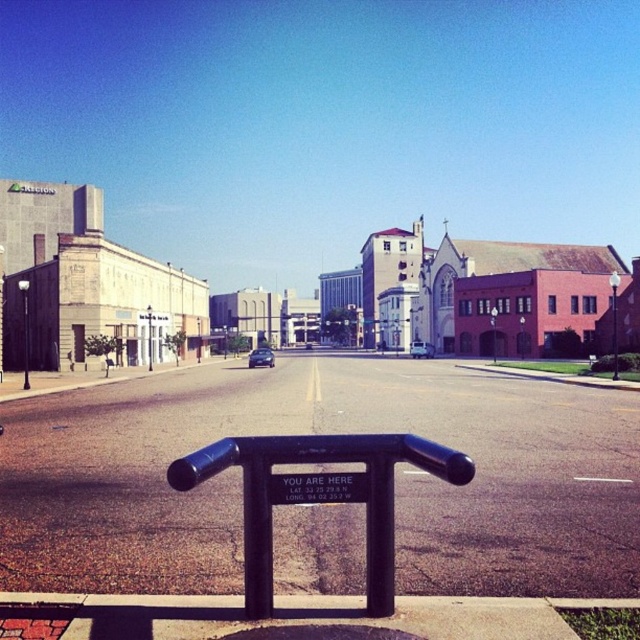
Question: Can you confirm if silver metallic sedan at center is smaller than shiny black sedan at center?

Choices:
 (A) no
 (B) yes

Answer: (A)

Question: Which point appears closest to the camera in this image?

Choices:
 (A) [420, 451]
 (B) [257, 353]
 (C) [305, 342]

Answer: (A)

Question: Is silver metallic sedan at center further to the viewer compared to brushed metal pole at center?

Choices:
 (A) yes
 (B) no

Answer: (A)

Question: Which point is closer to the camera taking this photo?

Choices:
 (A) (410, 436)
 (B) (272, 360)
 (C) (307, 348)

Answer: (A)

Question: Estimate the real-world distances between objects in this image. Which object is closer to the shiny black sedan at center?

Choices:
 (A) black matte rail at center
 (B) silver metallic sedan at center
 (C) satin black sedan at center
 (D) brushed metal pole at center

Answer: (C)

Question: Is satin black sedan at center to the left of brushed metal pole at center from the viewer's perspective?

Choices:
 (A) no
 (B) yes

Answer: (A)